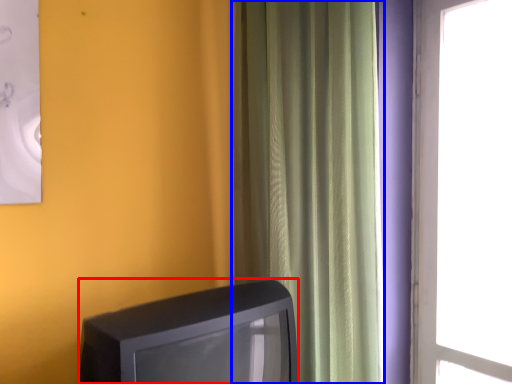
Question: Which object appears closest to the camera in this image, television (highlighted by a red box) or curtain (highlighted by a blue box)?

Choices:
 (A) television
 (B) curtain

Answer: (A)